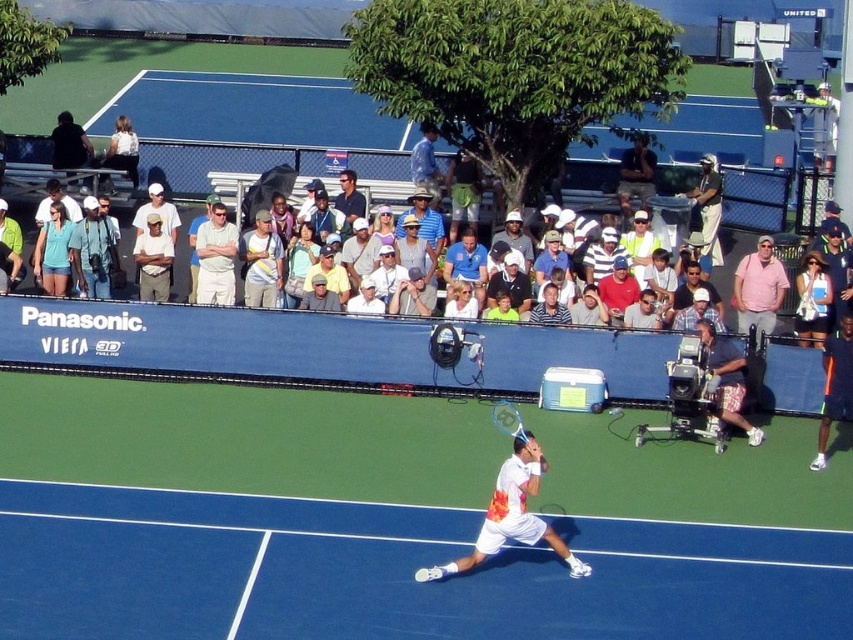
Can you confirm if blue synthetic turf at center is taller than white matte tennis racket at center?

Yes.

Who is higher up, blue synthetic turf at center or white matte tennis racket at center?

blue synthetic turf at center

Is point (631, 541) behind point (527, 438)?

Yes, point (631, 541) is behind point (527, 438).

This screenshot has height=640, width=853. Find the location of `blue synthetic turf at center`. blue synthetic turf at center is located at coordinates (393, 522).

Which of these two, pink cotton shirt at right or dark blue shirt at center, stands taller?

dark blue shirt at center is taller.

The image size is (853, 640). What do you see at coordinates (758, 289) in the screenshot? I see `pink cotton shirt at right` at bounding box center [758, 289].

This screenshot has width=853, height=640. Describe the element at coordinates (758, 289) in the screenshot. I see `pink cotton shirt at right` at that location.

This screenshot has width=853, height=640. Find the location of `pink cotton shirt at right`. pink cotton shirt at right is located at coordinates tap(758, 289).

Can you confirm if white matte tennis racket at center is positioned to the left of dark blue shorts at right?

Indeed, white matte tennis racket at center is positioned on the left side of dark blue shorts at right.

In the scene shown: Does white matte tennis racket at center appear on the right side of dark blue shorts at right?

Incorrect, white matte tennis racket at center is not on the right side of dark blue shorts at right.

Does point (543, 522) come behind point (759, 440)?

No, it is not.

The height and width of the screenshot is (640, 853). I want to click on white matte tennis racket at center, so click(x=511, y=515).